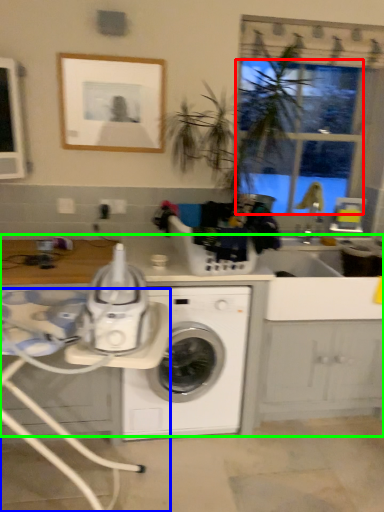
Question: Which object is the farthest from window screen (highlighted by a red box)? Choose among these: table (highlighted by a blue box) or counter top (highlighted by a green box).

Choices:
 (A) table
 (B) counter top

Answer: (A)